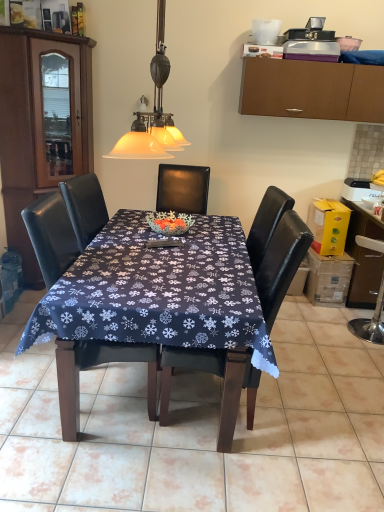
Where is `vacant area on top of dark blue fabric at center (from a real-world perspective)`? The image size is (384, 512). vacant area on top of dark blue fabric at center (from a real-world perspective) is located at coordinates (x=210, y=393).